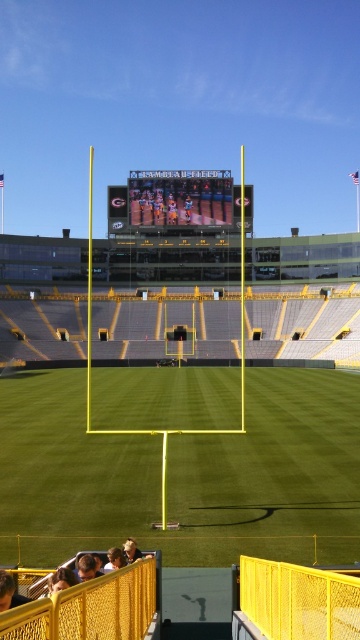
You are a photographer standing at the center of the field at Lambeau Field. You want to take a photo of the light brown hair at lower left. Which direction should you point your camera to capture it?

The light brown hair at lower left is located at point 0.908 on the x axis and 0.172 on the y axis. Since the photographer is at the center, they should point the camera to the lower left direction to capture it.

You are a drone operator tasked with capturing aerial footage of the matte black scoreboard at center at Lambeau Field. Your drone must fly from the north end zone to the scoreboard. Given the coordinates provided, in which cardinal direction should the drone primarily fly to reach the scoreboard?

The matte black scoreboard at center is located at point 0.309 on the x and 0.5 on the y. Since the stadium is oriented with the north end zone at one end, the scoreboard is positioned closer to the east side. Therefore, the drone should primarily fly east to reach the scoreboard.